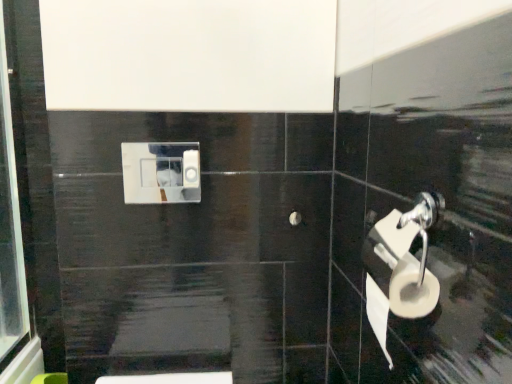
Find the location of a particular element. white matte toilet paper at right, which is counted as the second toilet paper, starting from the left is located at coordinates click(x=401, y=270).

In order to face white matte toilet paper at right, which is the second toilet paper in top-to-bottom order, should I rotate leftwards or rightwards?

It's best to rotate right around 18.032 degrees.

The image size is (512, 384). Describe the element at coordinates (401, 270) in the screenshot. I see `white matte toilet paper at right, which is the second toilet paper in top-to-bottom order` at that location.

Locate an element on the screen. This screenshot has height=384, width=512. white plastic toilet paper at center, which is counted as the first toilet paper, starting from the top is located at coordinates (191, 169).

Describe the element at coordinates (191, 169) in the screenshot. I see `white plastic toilet paper at center, which is the second toilet paper from right to left` at that location.

Where is `white matte toilet paper at right, which is counted as the second toilet paper, starting from the left`? white matte toilet paper at right, which is counted as the second toilet paper, starting from the left is located at coordinates (401, 270).

Based on the photo, is white matte toilet paper at right, which is the 1th toilet paper from front to back, to the left or to the right of white plastic toilet paper at center, which ranks as the 2th toilet paper in bottom-to-top order, in the image?

Clearly, white matte toilet paper at right, which is the 1th toilet paper from front to back, is on the right of white plastic toilet paper at center, which ranks as the 2th toilet paper in bottom-to-top order, in the image.

In the image, is white matte toilet paper at right, which is the second toilet paper in top-to-bottom order, positioned in front of or behind white plastic toilet paper at center, positioned as the 1th toilet paper in back-to-front order?

Clearly, white matte toilet paper at right, which is the second toilet paper in top-to-bottom order, is in front of white plastic toilet paper at center, positioned as the 1th toilet paper in back-to-front order.

Does point (425, 253) come behind point (194, 171)?

No, (425, 253) is closer to viewer.

From the image's perspective, does white matte toilet paper at right, which is the second toilet paper in top-to-bottom order, appear lower than white plastic toilet paper at center, which is the second toilet paper in front-to-back order?

Yes, from the image's perspective, white matte toilet paper at right, which is the second toilet paper in top-to-bottom order, is below white plastic toilet paper at center, which is the second toilet paper in front-to-back order.

From a real-world perspective, is white matte toilet paper at right, the 1th toilet paper ordered from the bottom, physically located above or below white plastic toilet paper at center, which is the second toilet paper from right to left?

From a real-world perspective, white matte toilet paper at right, the 1th toilet paper ordered from the bottom, is physically below white plastic toilet paper at center, which is the second toilet paper from right to left.

Considering the relative sizes of white matte toilet paper at right, the 1th toilet paper ordered from the bottom, and white plastic toilet paper at center, which is the second toilet paper from right to left, in the image provided, is white matte toilet paper at right, the 1th toilet paper ordered from the bottom, thinner than white plastic toilet paper at center, which is the second toilet paper from right to left,?

In fact, white matte toilet paper at right, the 1th toilet paper ordered from the bottom, might be wider than white plastic toilet paper at center, which is the second toilet paper from right to left.

Considering the relative sizes of white matte toilet paper at right, the 1th toilet paper viewed from the right, and white plastic toilet paper at center, positioned as the 1th toilet paper in back-to-front order, in the image provided, is white matte toilet paper at right, the 1th toilet paper viewed from the right, shorter than white plastic toilet paper at center, positioned as the 1th toilet paper in back-to-front order,?

No.

Considering the relative sizes of white matte toilet paper at right, which is counted as the second toilet paper, starting from the left, and white plastic toilet paper at center, which is the second toilet paper in front-to-back order, in the image provided, is white matte toilet paper at right, which is counted as the second toilet paper, starting from the left, smaller than white plastic toilet paper at center, which is the second toilet paper in front-to-back order,?

No.

Is white matte toilet paper at right, the 1th toilet paper viewed from the right, positioned beyond the bounds of white plastic toilet paper at center, which ranks as the 2th toilet paper in bottom-to-top order?

Yes, white matte toilet paper at right, the 1th toilet paper viewed from the right, is located beyond the bounds of white plastic toilet paper at center, which ranks as the 2th toilet paper in bottom-to-top order.

Is white matte toilet paper at right, which is counted as the second toilet paper, starting from the left, far from white plastic toilet paper at center, positioned as the 1th toilet paper in back-to-front order?

No, white matte toilet paper at right, which is counted as the second toilet paper, starting from the left, is in close proximity to white plastic toilet paper at center, positioned as the 1th toilet paper in back-to-front order.

Is white matte toilet paper at right, the 1th toilet paper viewed from the right, aimed at white plastic toilet paper at center, which ranks as the 2th toilet paper in bottom-to-top order?

No.

What's the angular difference between white matte toilet paper at right, which is counted as the 2th toilet paper, starting from the back, and white plastic toilet paper at center, which is counted as the 1th toilet paper, starting from the left,'s facing directions?

The angle between the facing direction of white matte toilet paper at right, which is counted as the 2th toilet paper, starting from the back, and the facing direction of white plastic toilet paper at center, which is counted as the 1th toilet paper, starting from the left, is 90 degrees.

What are the coordinates of `toilet paper that is on the right side of white plastic toilet paper at center, which is counted as the 1th toilet paper, starting from the left` in the screenshot? It's located at (401, 270).

Can you confirm if white plastic toilet paper at center, which is counted as the first toilet paper, starting from the top, is positioned to the left of white matte toilet paper at right, which is the 1th toilet paper from front to back?

Yes.

Is white plastic toilet paper at center, which is the second toilet paper from right to left, positioned in front of white matte toilet paper at right, which is the 1th toilet paper from front to back?

No, white plastic toilet paper at center, which is the second toilet paper from right to left, is further to the viewer.

Which is closer to the camera, (x=199, y=157) or (x=397, y=296)?

The point (x=397, y=296) is more forward.

From the image's perspective, which is above, white plastic toilet paper at center, positioned as the 1th toilet paper in back-to-front order, or white matte toilet paper at right, the 1th toilet paper viewed from the right?

white plastic toilet paper at center, positioned as the 1th toilet paper in back-to-front order, appears higher in the image.

From a real-world perspective, which is physically above, white plastic toilet paper at center, which is counted as the first toilet paper, starting from the top, or white matte toilet paper at right, which is the 1th toilet paper from front to back?

white plastic toilet paper at center, which is counted as the first toilet paper, starting from the top, is physically above.

Which object is wider, white plastic toilet paper at center, which is counted as the first toilet paper, starting from the top, or white matte toilet paper at right, the 1th toilet paper viewed from the right?

With larger width is white matte toilet paper at right, the 1th toilet paper viewed from the right.

Which of these two, white plastic toilet paper at center, which is counted as the first toilet paper, starting from the top, or white matte toilet paper at right, which is the second toilet paper in top-to-bottom order, stands taller?

Standing taller between the two is white matte toilet paper at right, which is the second toilet paper in top-to-bottom order.

Which of these two, white plastic toilet paper at center, which is counted as the 1th toilet paper, starting from the left, or white matte toilet paper at right, which is the 1th toilet paper from front to back, is bigger?

Bigger between the two is white matte toilet paper at right, which is the 1th toilet paper from front to back.

Would you say white plastic toilet paper at center, which is the second toilet paper from right to left, is outside white matte toilet paper at right, the 1th toilet paper ordered from the bottom?

Indeed, white plastic toilet paper at center, which is the second toilet paper from right to left, is completely outside white matte toilet paper at right, the 1th toilet paper ordered from the bottom.

Are white plastic toilet paper at center, which is the second toilet paper from right to left, and white matte toilet paper at right, which is counted as the second toilet paper, starting from the left, located far from each other?

That's not correct — white plastic toilet paper at center, which is the second toilet paper from right to left, is a little close to white matte toilet paper at right, which is counted as the second toilet paper, starting from the left.

Is white plastic toilet paper at center, which is the second toilet paper from right to left, turned away from white matte toilet paper at right, the 1th toilet paper ordered from the bottom?

No.

What's the angular difference between white plastic toilet paper at center, which is the second toilet paper in front-to-back order, and white matte toilet paper at right, the 1th toilet paper ordered from the bottom,'s facing directions?

The angular difference between white plastic toilet paper at center, which is the second toilet paper in front-to-back order, and white matte toilet paper at right, the 1th toilet paper ordered from the bottom, is 90 degrees.

Based on the photo, how distant is white plastic toilet paper at center, which ranks as the 2th toilet paper in bottom-to-top order, from white matte toilet paper at right, the 1th toilet paper viewed from the right?

white plastic toilet paper at center, which ranks as the 2th toilet paper in bottom-to-top order, is 23.04 inches away from white matte toilet paper at right, the 1th toilet paper viewed from the right.

Image resolution: width=512 pixels, height=384 pixels. Find the location of `toilet paper above the white matte toilet paper at right, the 1th toilet paper viewed from the right (from the image's perspective)`. toilet paper above the white matte toilet paper at right, the 1th toilet paper viewed from the right (from the image's perspective) is located at coordinates (191, 169).

You are a GUI agent. You are given a task and a screenshot of the screen. Output one action in this format:
    pyautogui.click(x=<x>, y=<y>)
    Task: Click on the toilet paper above the white matte toilet paper at right, which is counted as the 2th toilet paper, starting from the back (from a real-world perspective)
    
    Given the screenshot: What is the action you would take?
    pyautogui.click(x=191, y=169)

Image resolution: width=512 pixels, height=384 pixels. In the image, there is a white plastic toilet paper at center, which is the second toilet paper from right to left. Identify the location of toilet paper below it (from the image's perspective). (401, 270).